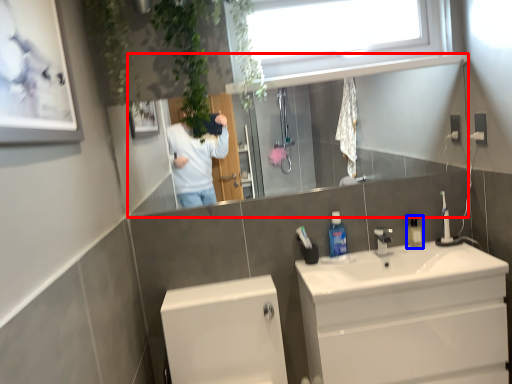
Question: Which object appears farthest to the camera in this image, mirror (highlighted by a red box) or mouthwash (highlighted by a blue box)?

Choices:
 (A) mirror
 (B) mouthwash

Answer: (B)